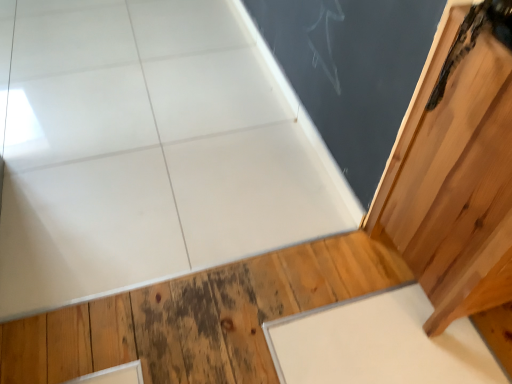
You are a GUI agent. You are given a task and a screenshot of the screen. Output one action in this format:
    pyautogui.click(x=<x>, y=<y>)
    Task: Click on the free space above white matte slate at lower right (from a real-world perspective)
    
    Given the screenshot: What is the action you would take?
    pyautogui.click(x=373, y=344)